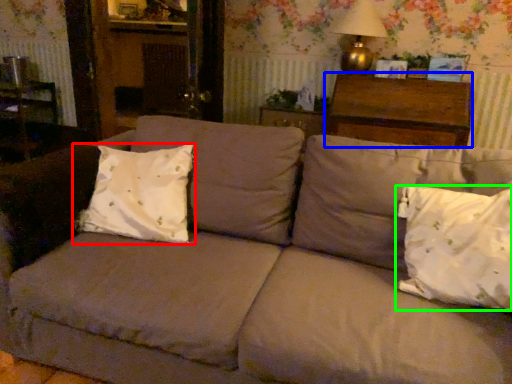
Question: Which object is the farthest from pillow (highlighted by a red box)? Choose among these: hardwood (highlighted by a blue box) or pillow (highlighted by a green box).

Choices:
 (A) hardwood
 (B) pillow

Answer: (A)